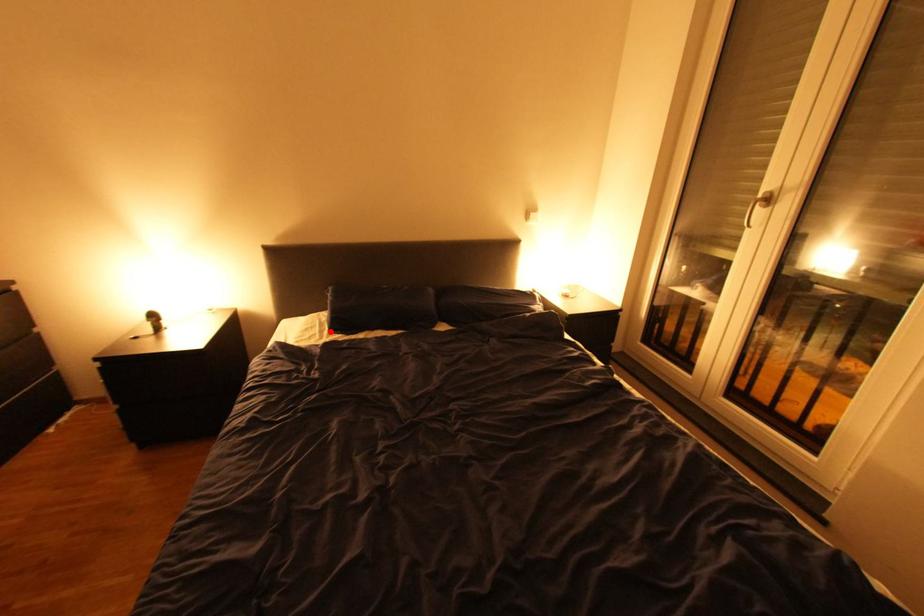
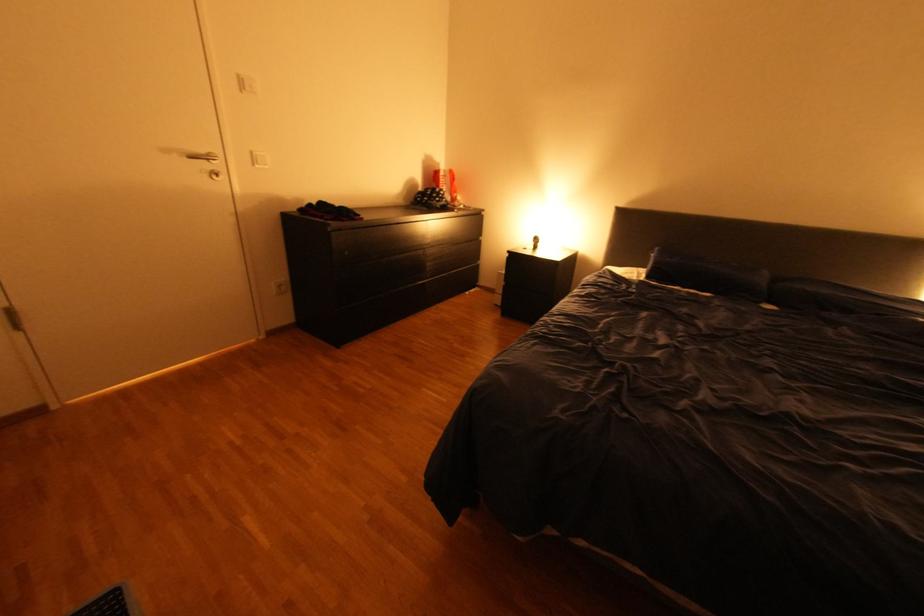
The point at the highlighted location is marked in the first image. Where is the corresponding point in the second image?

(648, 277)